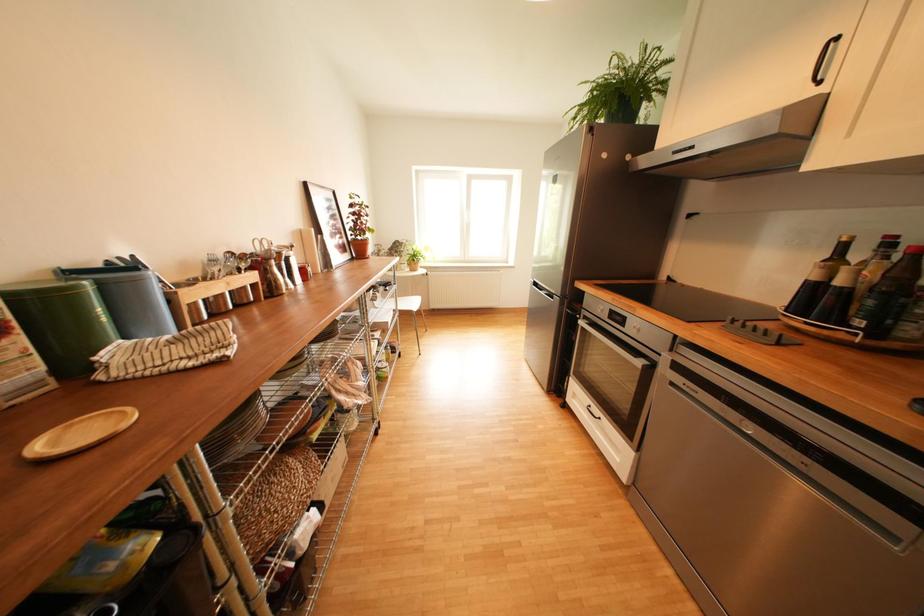
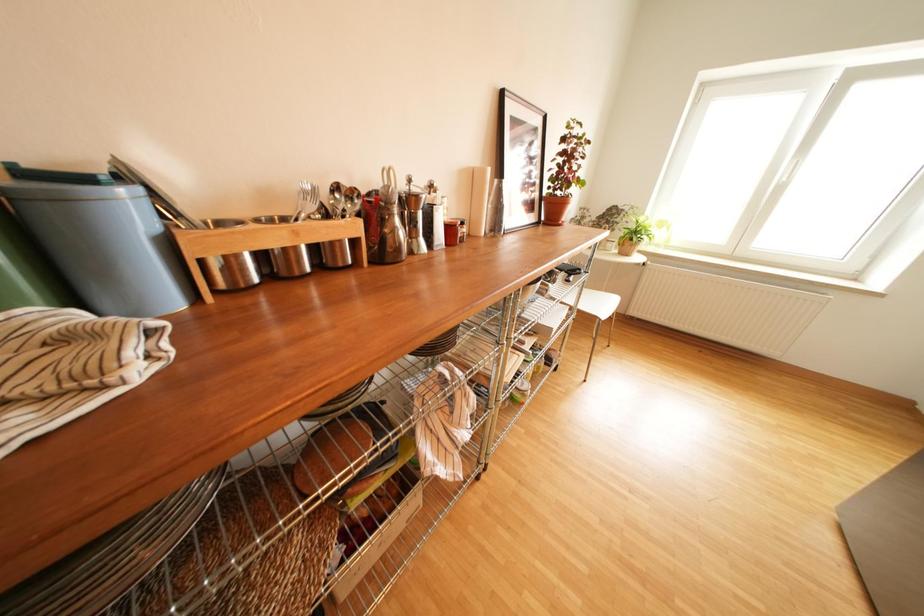
Question: Based on the continuous images, in which direction is the camera rotating? Reply with the corresponding letter.

Choices:
 (A) Left
 (B) Right
 (C) Up
 (D) Down

Answer: (A)